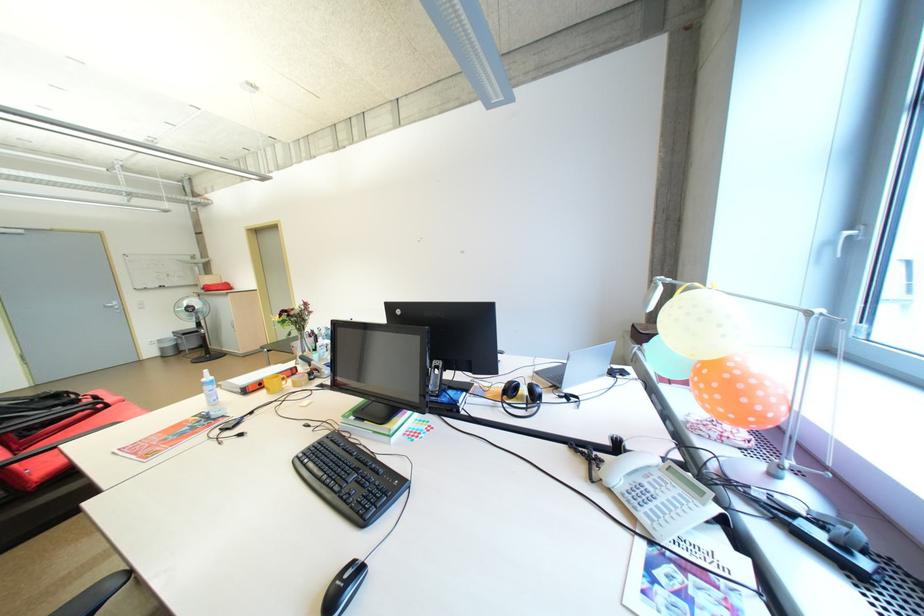
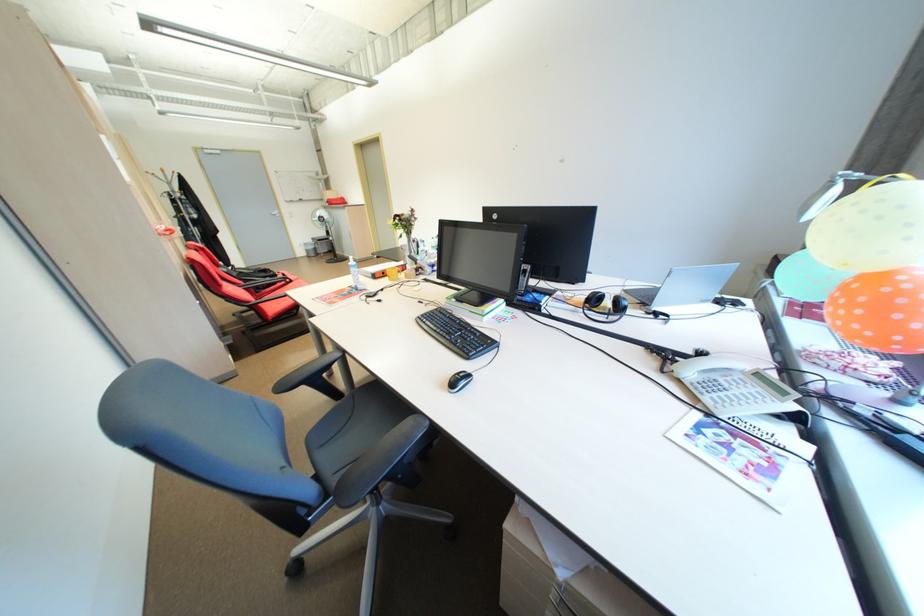
In the second image, find the point that corresponds to [211,398] in the first image.

(359, 277)